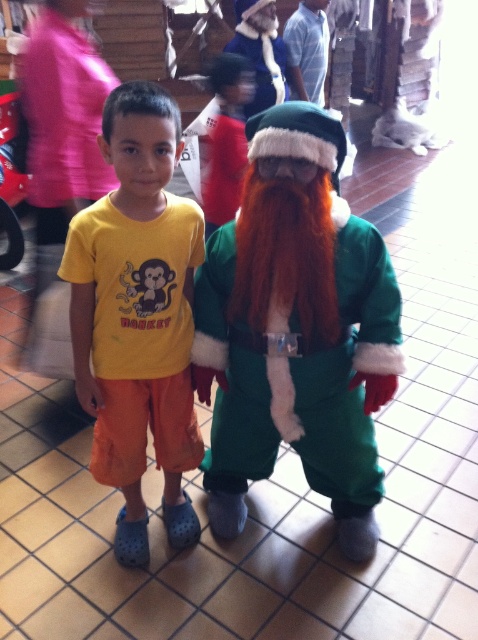
Question: Does green fuzzy santa at center appear over yellow cotton t-shirt at center?

Choices:
 (A) no
 (B) yes

Answer: (A)

Question: Where is green fuzzy santa at center located in relation to yellow cotton t-shirt at center in the image?

Choices:
 (A) left
 (B) right

Answer: (B)

Question: Can you confirm if green fuzzy santa at center is bigger than yellow cotton t-shirt at center?

Choices:
 (A) no
 (B) yes

Answer: (B)

Question: Which of the following is the farthest from the observer?

Choices:
 (A) (126, 193)
 (B) (249, 125)

Answer: (B)

Question: Which of the following is the closest to the observer?

Choices:
 (A) (267, 116)
 (B) (77, 257)

Answer: (A)